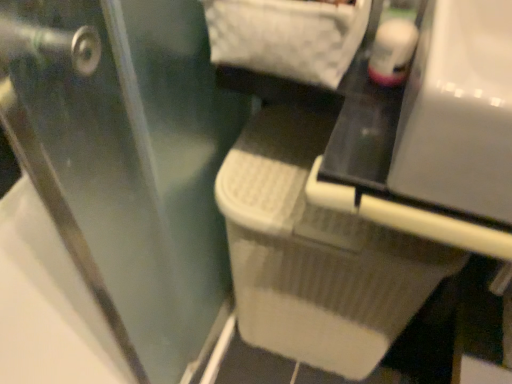
Question: Looking at their shapes, would you say transparent plastic screen door at lower right is wider or thinner than white textured laundry basket at center?

Choices:
 (A) thin
 (B) wide

Answer: (A)

Question: From the image's perspective, relative to white textured laundry basket at center, is transparent plastic screen door at lower right above or below?

Choices:
 (A) above
 (B) below

Answer: (A)

Question: Based on their relative distances, which object is farther from the white textured laundry basket at center?

Choices:
 (A) white plastic vanity at center
 (B) transparent plastic screen door at lower right

Answer: (A)

Question: Which object is the closest to the white textured laundry basket at center?

Choices:
 (A) white plastic vanity at center
 (B) transparent plastic screen door at lower right

Answer: (B)